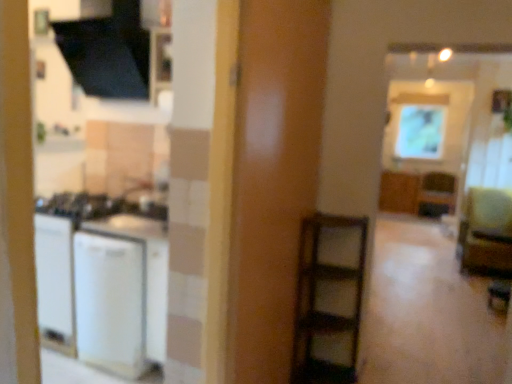
Question: Considering the positions of matte brown screen door at center and white matte refrigerator at left in the image, is matte brown screen door at center taller or shorter than white matte refrigerator at left?

Choices:
 (A) tall
 (B) short

Answer: (A)

Question: Looking at their shapes, would you say matte brown screen door at center is wider or thinner than white matte refrigerator at left?

Choices:
 (A) wide
 (B) thin

Answer: (B)

Question: Based on their relative distances, which object is farther from the white matte refrigerator at left?

Choices:
 (A) wooden cabinet at upper right, the second cabinetry in the right-to-left sequence
 (B) matte brown screen door at center
 (C) matte glass window screen at upper right
 (D) wooden cabinet at center-right, the first cabinetry positioned from the right
 (E) green fabric armchair at right

Answer: (C)

Question: Which object is positioned farthest from the white matte refrigerator at left?

Choices:
 (A) wooden cabinet at center-right, which ranks as the second cabinetry in left-to-right order
 (B) wooden cabinet at upper right, the second cabinetry in the right-to-left sequence
 (C) matte brown screen door at center
 (D) green fabric armchair at right
 (E) matte glass window screen at upper right

Answer: (E)